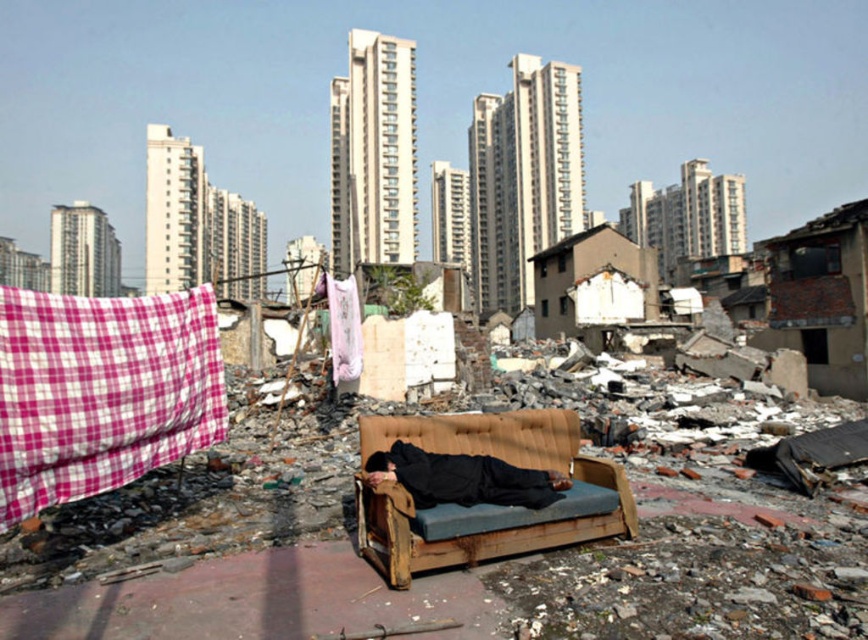
You are a delivery person who needs to place a small package between the pink checkered fabric at left and the wooden couch at center. The package requires a space of 5 feet. Can you fit it there?

The pink checkered fabric at left is 6.79 feet away from wooden couch at center, so yes, the package can be placed between them since the distance is more than enough to accommodate the 5 feet requirement.

You are a photographer aiming to capture the contrast between the modern cityscape and the abandoned area. You notice the pink checkered fabric at left and the black fabric person at center in your frame. Which object is positioned closer to the camera?

The pink checkered fabric at left is closer to the viewer than the black fabric person at center, so it would appear closer to the camera in the photograph.